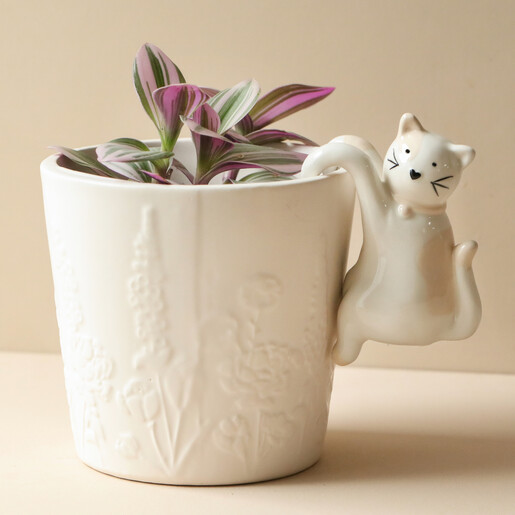
You are a GUI agent. You are given a task and a screenshot of the screen. Output one action in this format:
    pyautogui.click(x=<x>, y=<y>)
    Task: Click on the wall
    The image size is (515, 515).
    Given the screenshot: What is the action you would take?
    pyautogui.click(x=43, y=277)